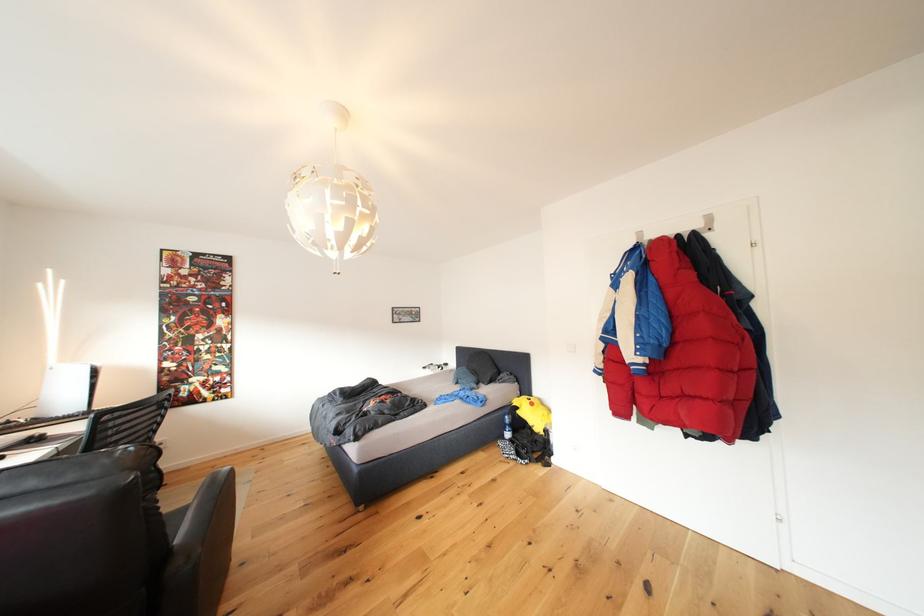
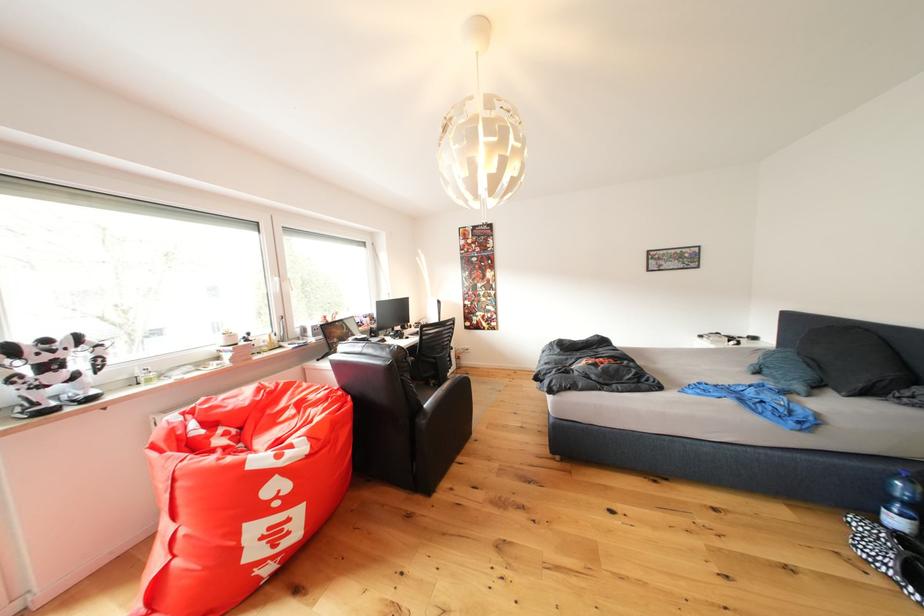
Find the pixel in the second image that matches the point at 508,448 in the first image.

(864, 527)